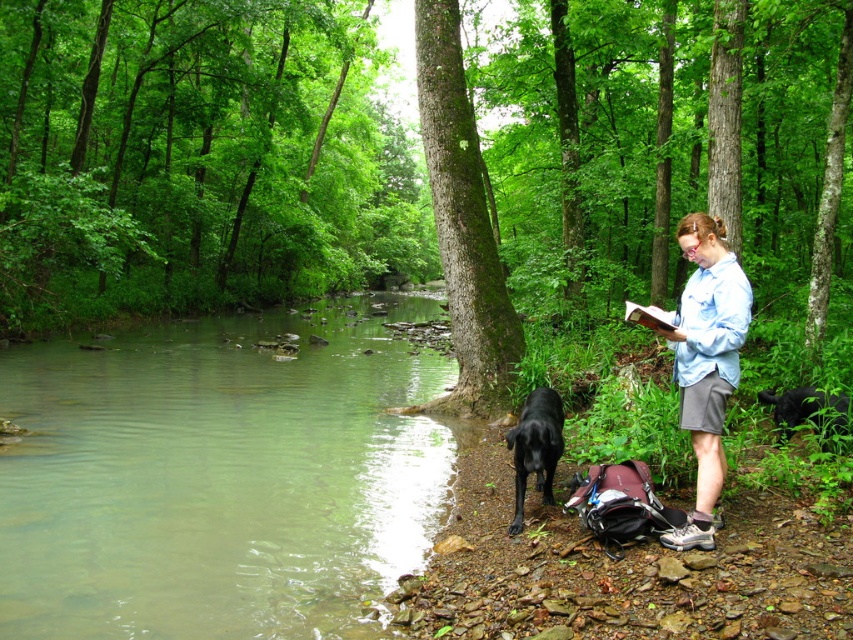
Does black smooth dog at lower center have a lesser width compared to black furry dog at lower right?

Correct, black smooth dog at lower center's width is less than black furry dog at lower right's.

Between point (537, 454) and point (799, 412), which one is positioned behind?

The point (799, 412) is more distant.

This screenshot has width=853, height=640. Describe the element at coordinates (535, 448) in the screenshot. I see `black smooth dog at lower center` at that location.

Locate an element on the screen. Image resolution: width=853 pixels, height=640 pixels. black smooth dog at lower center is located at coordinates (535, 448).

Is light blue shirt at center below black smooth dog at lower center?

Incorrect, light blue shirt at center is not positioned below black smooth dog at lower center.

Who is more forward, (682, 225) or (548, 464)?

Point (682, 225) is in front.

Find the location of a particular element. light blue shirt at center is located at coordinates (706, 362).

Does green leafy trees at upper center appear over light blue shirt at center?

Correct, green leafy trees at upper center is located above light blue shirt at center.

Can you confirm if green leafy trees at upper center is smaller than light blue shirt at center?

No, green leafy trees at upper center is not smaller than light blue shirt at center.

Between point (697, 188) and point (688, 424), which one is positioned in front?

Point (688, 424) is more forward.

Find the location of `green leafy trees at upper center`. green leafy trees at upper center is located at coordinates (195, 157).